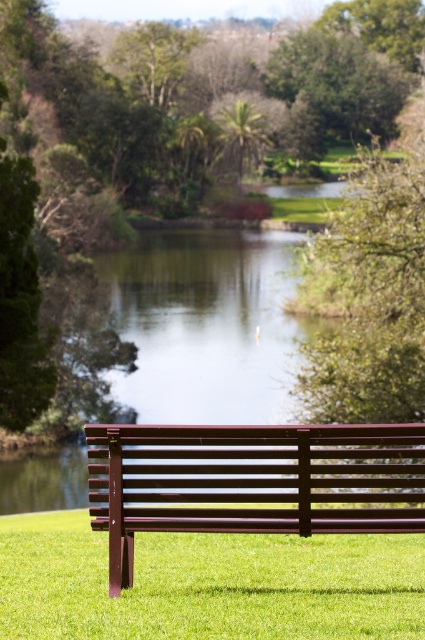
Which of these two, green grass at center or metallic brown bench at lower center, stands shorter?

With less height is metallic brown bench at lower center.

Where is `green grass at center`? This screenshot has width=425, height=640. green grass at center is located at coordinates (207, 584).